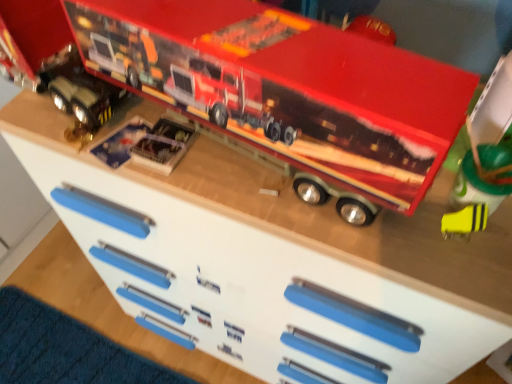
Question: From the image's perspective, is yellow matte eraser at lower right, placed as the first toy when sorted from right to left, above or below metallic red truck at upper center, which ranks as the 2th toy in right-to-left order?

Choices:
 (A) below
 (B) above

Answer: (A)

Question: Is yellow matte eraser at lower right, placed as the first toy when sorted from right to left, taller or shorter than metallic red truck at upper center, which ranks as the 2th toy in right-to-left order?

Choices:
 (A) tall
 (B) short

Answer: (B)

Question: Which object is positioned farthest from the metallic silver toy truck at center, arranged as the 1th toy when viewed from the left?

Choices:
 (A) yellow matte eraser at lower right, which is the fourth toy from left to right
 (B) metallic red truck at upper center, which ranks as the 2th toy in right-to-left order
 (C) clear plastic toy at center, marked as the second toy in a left-to-right arrangement

Answer: (A)

Question: Which object is positioned closest to the metallic silver toy truck at center, positioned as the fourth toy in right-to-left order?

Choices:
 (A) clear plastic toy at center, which is counted as the third toy, starting from the right
 (B) metallic red truck at upper center, placed as the 3th toy when sorted from left to right
 (C) yellow matte eraser at lower right, placed as the first toy when sorted from right to left

Answer: (A)